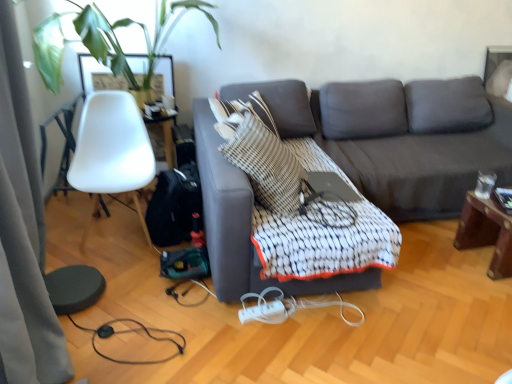
Question: From the image's perspective, would you say silky gray curtain at left is positioned over mahogany wood side table at right?

Choices:
 (A) no
 (B) yes

Answer: (B)

Question: Is silky gray curtain at left beside mahogany wood side table at right?

Choices:
 (A) yes
 (B) no

Answer: (B)

Question: Does silky gray curtain at left come behind mahogany wood side table at right?

Choices:
 (A) no
 (B) yes

Answer: (A)

Question: Considering the relative sizes of silky gray curtain at left and mahogany wood side table at right in the image provided, is silky gray curtain at left thinner than mahogany wood side table at right?

Choices:
 (A) yes
 (B) no

Answer: (A)

Question: Considering the relative sizes of silky gray curtain at left and mahogany wood side table at right in the image provided, is silky gray curtain at left taller than mahogany wood side table at right?

Choices:
 (A) no
 (B) yes

Answer: (B)

Question: Is point (249, 119) closer or farther from the camera than point (12, 145)?

Choices:
 (A) closer
 (B) farther

Answer: (B)

Question: Would you say striped fabric throw pillow at center is to the left or to the right of silky gray curtain at left in the picture?

Choices:
 (A) left
 (B) right

Answer: (B)

Question: Is striped fabric throw pillow at center situated inside silky gray curtain at left or outside?

Choices:
 (A) inside
 (B) outside

Answer: (B)

Question: In the image, is striped fabric throw pillow at center positioned in front of or behind silky gray curtain at left?

Choices:
 (A) front
 (B) behind

Answer: (B)

Question: In the image, is white plastic cable at lower center, which is counted as the second cable, starting from the left, positioned in front of or behind silky gray curtain at left?

Choices:
 (A) behind
 (B) front

Answer: (A)

Question: Considering the relative positions of white plastic cable at lower center, positioned as the first cable in right-to-left order, and silky gray curtain at left in the image provided, is white plastic cable at lower center, positioned as the first cable in right-to-left order, to the left or to the right of silky gray curtain at left?

Choices:
 (A) right
 (B) left

Answer: (A)

Question: In terms of size, does white plastic cable at lower center, which is counted as the second cable, starting from the left, appear bigger or smaller than silky gray curtain at left?

Choices:
 (A) big
 (B) small

Answer: (B)

Question: From the image's perspective, relative to silky gray curtain at left, is white plastic cable at lower center, positioned as the first cable in right-to-left order, above or below?

Choices:
 (A) below
 (B) above

Answer: (A)

Question: Is black rubber cable at lower left, which appears as the 1th cable when viewed from the left, inside or outside of dark gray fabric couch at center?

Choices:
 (A) outside
 (B) inside

Answer: (A)

Question: Is point (133, 331) positioned closer to the camera than point (244, 215)?

Choices:
 (A) closer
 (B) farther

Answer: (B)